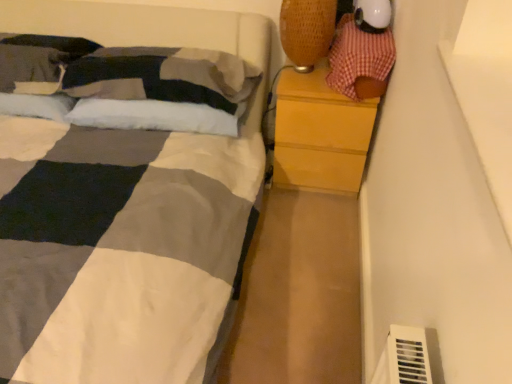
Question: Is checkered fabric toy at upper right to the left or to the right of white soft pillow at upper left, the 2th pillow in the left-to-right sequence, in the image?

Choices:
 (A) left
 (B) right

Answer: (B)

Question: From their relative heights in the image, would you say checkered fabric toy at upper right is taller or shorter than white soft pillow at upper left, the 2th pillow in the left-to-right sequence?

Choices:
 (A) tall
 (B) short

Answer: (A)

Question: Which object is positioned closest to the soft cotton pillow at upper left, arranged as the 2th pillow when viewed from the right?

Choices:
 (A) white soft pillow at upper left, placed as the 1th pillow when sorted from right to left
 (B) woven fabric table lamp at upper right
 (C) checkered fabric toy at upper right
 (D) wooden chest of drawers at right

Answer: (A)

Question: Which is nearer to the white soft pillow at upper left, the 2th pillow in the left-to-right sequence?

Choices:
 (A) woven fabric table lamp at upper right
 (B) soft cotton pillow at upper left, positioned as the 1th pillow in left-to-right order
 (C) wooden chest of drawers at right
 (D) checkered fabric toy at upper right

Answer: (B)